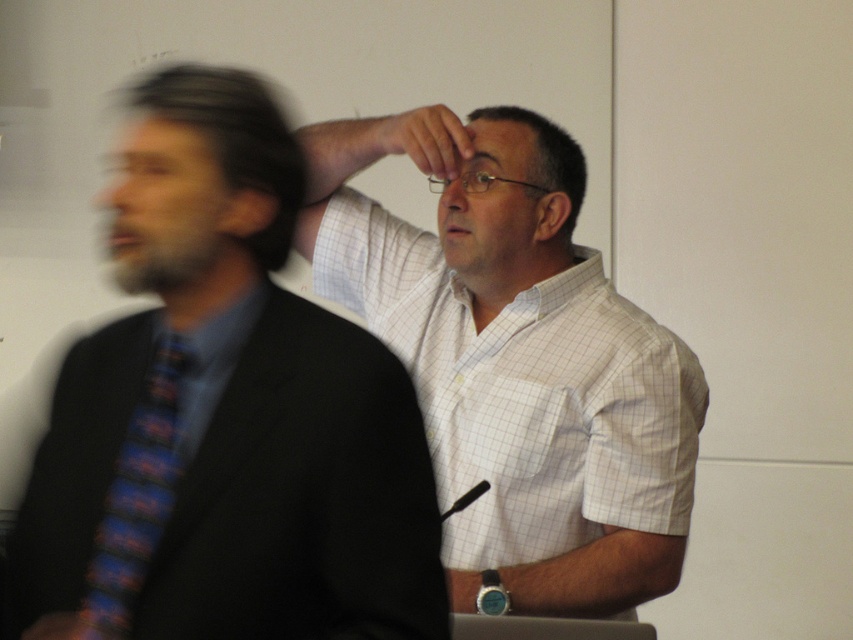
Question: Is blue striped tie at left bigger than matte black glasses at upper center?

Choices:
 (A) yes
 (B) no

Answer: (B)

Question: Is matte black suit at left below white checkered dress shirt at center?

Choices:
 (A) no
 (B) yes

Answer: (A)

Question: Which object is the farthest from the matte black suit at left?

Choices:
 (A) white checkered shirt at center
 (B) matte black glasses at upper center
 (C) blue striped tie at left

Answer: (A)

Question: Can you confirm if matte black suit at left is thinner than white checkered dress shirt at center?

Choices:
 (A) yes
 (B) no

Answer: (A)

Question: Which point is closer to the camera?

Choices:
 (A) matte black suit at left
 (B) white checkered shirt at center
 (C) white checkered dress shirt at center
 (D) dark brown hair at left

Answer: (A)

Question: Estimate the real-world distances between objects in this image. Which object is farther from the blue striped tie at left?

Choices:
 (A) white checkered shirt at center
 (B) matte black suit at left
 (C) white checkered dress shirt at center

Answer: (A)